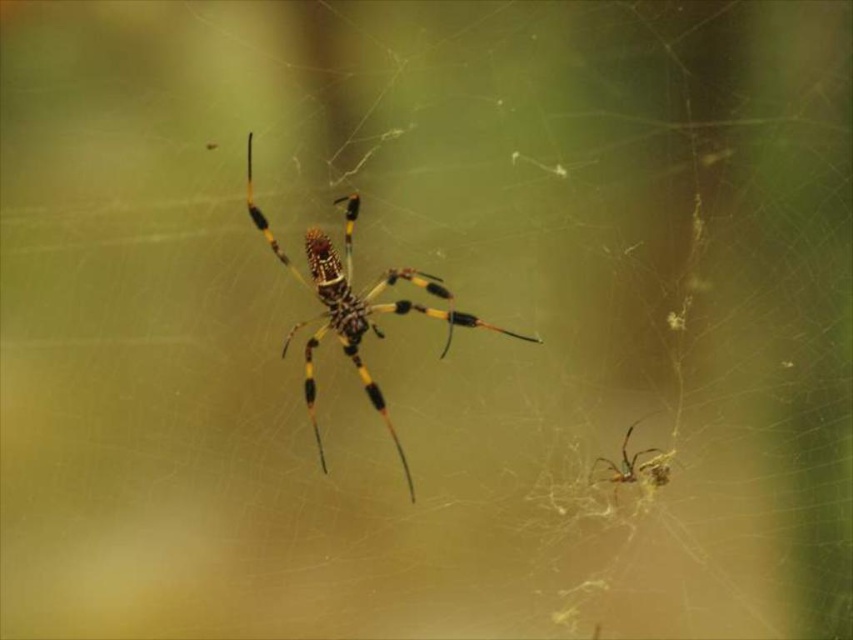
You are a small insect trying to navigate between the yellow and black fuzzy spider at center and the shiny metallic spider at lower right. Can you safely pass through the gap between them without getting caught?

The gap between the yellow and black fuzzy spider at center and the shiny metallic spider at lower right is 29.12 inches, which is wide enough for a small insect to pass through safely.

You are a photographer trying to capture the yellow and black fuzzy spider at center and the shiny metallic spider at lower right in a single shot. Which spider will appear larger in your photo?

The yellow and black fuzzy spider at center will appear larger in the photo because it is closer to the viewer than the shiny metallic spider at lower right.